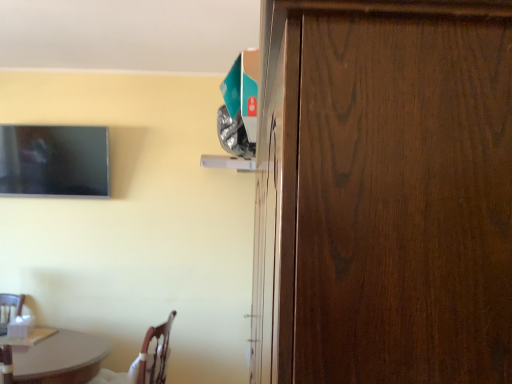
The width and height of the screenshot is (512, 384). I want to click on dark wood door at right, so click(383, 193).

Locate an element on the screen. This screenshot has width=512, height=384. matte black tv at upper left is located at coordinates pos(54,161).

How far apart are wooden chair at lower left and dark wood door at right?

They are 1.96 meters apart.

From the picture: From a real-world perspective, who is located lower, wooden chair at lower left or dark wood door at right?

In real-world perspective, wooden chair at lower left is lower.

Looking at this image, considering the positions of objects wooden chair at lower left and dark wood door at right in the image provided, who is more to the right, wooden chair at lower left or dark wood door at right?

dark wood door at right is more to the right.

Is wooden chair at lower left touching dark wood door at right?

wooden chair at lower left is not next to dark wood door at right, and they're not touching.

Between matte black tv at upper left and wooden chair at lower left, which one has less height?

wooden chair at lower left.

Identify the location of television above the wooden chair at lower left (from a real-world perspective). (54, 161).

From a real-world perspective, is dark wood door at right under matte black tv at upper left?

Correct, in the physical world, dark wood door at right is lower than matte black tv at upper left.

Is dark wood door at right not near matte black tv at upper left?

Yes, dark wood door at right and matte black tv at upper left are quite far apart.

Does dark wood door at right turn towards matte black tv at upper left?

Yes, dark wood door at right is oriented towards matte black tv at upper left.

Consider the image. What's the angular difference between dark wood door at right and matte black tv at upper left's facing directions?

90.8 degrees.

Do you think wooden chair at lower left is within matte black tv at upper left, or outside of it?

wooden chair at lower left is outside matte black tv at upper left.

Is wooden chair at lower left far away from matte black tv at upper left?

That's right, there is a large distance between wooden chair at lower left and matte black tv at upper left.

Which object is closer to the camera taking this photo, wooden chair at lower left or matte black tv at upper left?

wooden chair at lower left.

Which object is thinner, wooden chair at lower left or matte black tv at upper left?

matte black tv at upper left.

From a real-world perspective, is dark wood door at right physically located above or below wooden chair at lower left?

In terms of real-world spatial position, dark wood door at right is above wooden chair at lower left.

Is dark wood door at right at the left side of wooden chair at lower left?

In fact, dark wood door at right is to the right of wooden chair at lower left.

Between dark wood door at right and wooden chair at lower left, which one has smaller size?

wooden chair at lower left is smaller.

Does dark wood door at right have a greater width compared to wooden chair at lower left?

Yes.

Find the location of `door in front of the matte black tv at upper left`. door in front of the matte black tv at upper left is located at coordinates (383, 193).

Is matte black tv at upper left at the right side of dark wood door at right?

In fact, matte black tv at upper left is to the left of dark wood door at right.

Looking at this image, which of these two, matte black tv at upper left or dark wood door at right, is bigger?

dark wood door at right is bigger.

Find the location of a particular element. door in front of the wooden chair at lower left is located at coordinates (383, 193).

At what (x,y) coordinates should I click in order to perform the action: click on chair below the matte black tv at upper left (from a real-world perspective). Please return your answer as a coordinate pair (x, y). Looking at the image, I should click on (144, 360).

Looking at the image, which one is located closer to dark wood door at right, matte black tv at upper left or wooden chair at lower left?

The object closer to dark wood door at right is wooden chair at lower left.

Based on their spatial positions, is wooden chair at lower left or matte black tv at upper left closer to dark wood door at right?

The object closer to dark wood door at right is wooden chair at lower left.

From the image, which object appears to be farther from matte black tv at upper left, dark wood door at right or wooden chair at lower left?

Among the two, dark wood door at right is located further to matte black tv at upper left.

When comparing their distances from matte black tv at upper left, does wooden chair at lower left or dark wood door at right seem further?

Among the two, dark wood door at right is located further to matte black tv at upper left.

When comparing their distances from wooden chair at lower left, does matte black tv at upper left or dark wood door at right seem further?

dark wood door at right lies further to wooden chair at lower left than the other object.

Looking at the image, which one is located further to wooden chair at lower left, dark wood door at right or matte black tv at upper left?

dark wood door at right lies further to wooden chair at lower left than the other object.

Where is `chair between dark wood door at right and matte black tv at upper left in the front-back direction`? Image resolution: width=512 pixels, height=384 pixels. chair between dark wood door at right and matte black tv at upper left in the front-back direction is located at coordinates (144, 360).